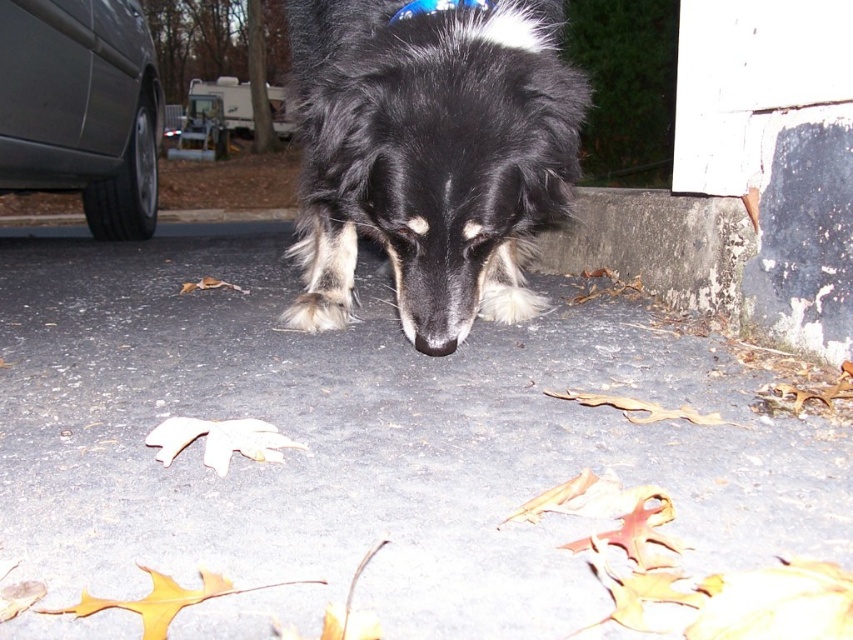
Can you confirm if black fluffy dog at center is positioned to the left of blue fabric neckband at upper center?

Yes, black fluffy dog at center is to the left of blue fabric neckband at upper center.

Is black fluffy dog at center smaller than blue fabric neckband at upper center?

Actually, black fluffy dog at center might be larger than blue fabric neckband at upper center.

In order to click on black fluffy dog at center in this screenshot , I will do `click(430, 156)`.

The width and height of the screenshot is (853, 640). What are the coordinates of `black fluffy dog at center` in the screenshot? It's located at [430, 156].

Which is in front, point (584, 435) or point (537, 120)?

Point (584, 435)

Does point (426, 534) come in front of point (376, 189)?

Yes, it is.

Find the location of a particular element. gray asphalt pavement at center is located at coordinates (372, 445).

Does gray asphalt pavement at center appear over blue fabric neckband at upper center?

No, gray asphalt pavement at center is not above blue fabric neckband at upper center.

Is point (529, 348) behind point (473, 6)?

That is True.

This screenshot has width=853, height=640. What are the coordinates of `gray asphalt pavement at center` in the screenshot? It's located at (372, 445).

What are the coordinates of `gray asphalt pavement at center` in the screenshot? It's located at (372, 445).